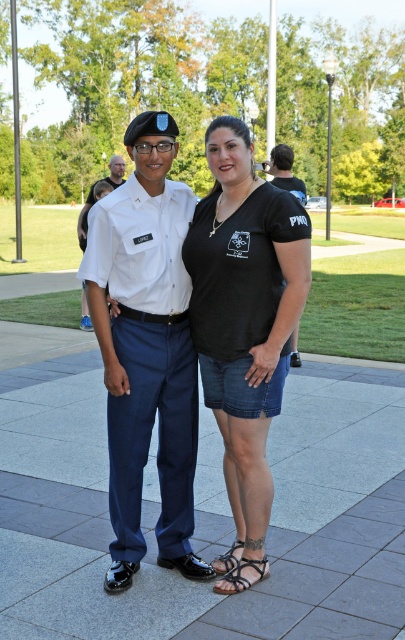
Between point (106, 188) and point (226, 573), which one is positioned behind?

Positioned behind is point (106, 188).

Which is in front, point (89, 205) or point (225, 579)?

Positioned in front is point (225, 579).

Which is in front, point (119, 173) or point (236, 564)?

Point (236, 564)

Identify the location of white uniform at center. This screenshot has height=640, width=405. (100, 195).

How far apart are matte blue pants at center and white uniform at center?

They are 1.72 meters apart.

Does matte blue pants at center appear on the left side of white uniform at center?

No, matte blue pants at center is not to the left of white uniform at center.

The image size is (405, 640). What do you see at coordinates (147, 358) in the screenshot? I see `matte blue pants at center` at bounding box center [147, 358].

You are a GUI agent. You are given a task and a screenshot of the screen. Output one action in this format:
    pyautogui.click(x=<x>, y=<y>)
    Task: Click on the matte blue pants at center
    Image resolution: width=405 pixels, height=640 pixels.
    Given the screenshot: What is the action you would take?
    pyautogui.click(x=147, y=358)

Does matte white uniform at center appear on the left side of black leather sandal at lower center?

Indeed, matte white uniform at center is positioned on the left side of black leather sandal at lower center.

Can you confirm if matte white uniform at center is positioned to the right of black leather sandal at lower center?

In fact, matte white uniform at center is to the left of black leather sandal at lower center.

What do you see at coordinates (245, 312) in the screenshot?
I see `matte white uniform at center` at bounding box center [245, 312].

Locate an element on the screen. This screenshot has width=405, height=640. matte white uniform at center is located at coordinates (245, 312).